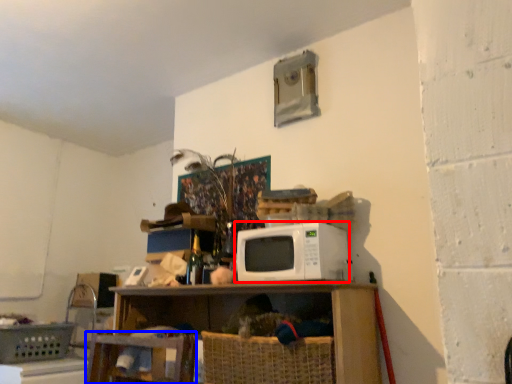
Question: Which object appears farthest to the camera in this image, microwave oven (highlighted by a red box) or swivel chair (highlighted by a blue box)?

Choices:
 (A) microwave oven
 (B) swivel chair

Answer: (B)